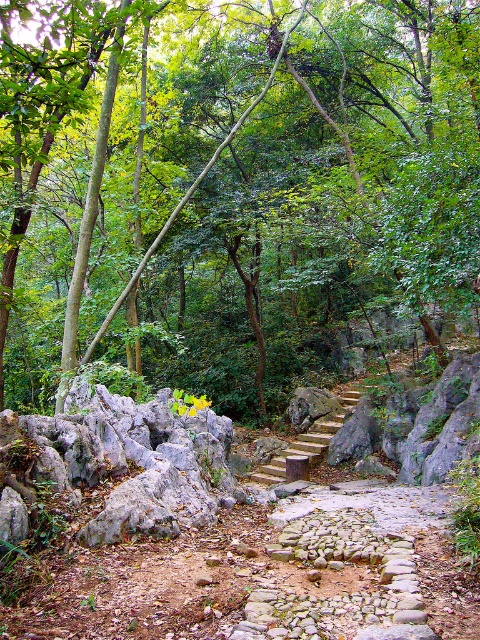
Can you confirm if green leafy tree at center is positioned to the left of wooden stairs at center?

Yes, green leafy tree at center is to the left of wooden stairs at center.

Does green leafy tree at center appear on the right side of wooden stairs at center?

Incorrect, green leafy tree at center is not on the right side of wooden stairs at center.

Image resolution: width=480 pixels, height=640 pixels. I want to click on green leafy tree at center, so click(x=261, y=200).